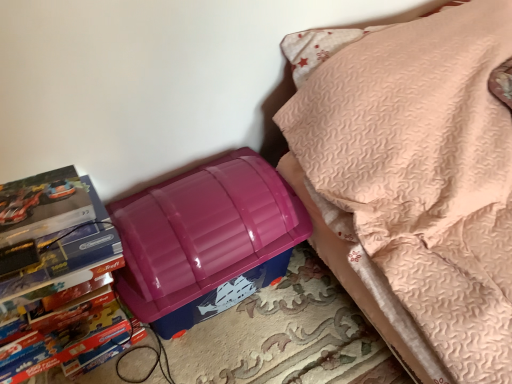
The image size is (512, 384). What do you see at coordinates (65, 289) in the screenshot?
I see `matte cardboard book at left` at bounding box center [65, 289].

At what (x,y) coordinates should I click in order to perform the action: click on purple plastic storage bin at lower left. Please return your answer as a coordinate pair (x, y). The height and width of the screenshot is (384, 512). Looking at the image, I should click on (412, 181).

Describe the element at coordinates (412, 181) in the screenshot. I see `purple plastic storage bin at lower left` at that location.

Where is `matte cardboard book at left`? Image resolution: width=512 pixels, height=384 pixels. matte cardboard book at left is located at coordinates [65, 289].

Is purple plastic storage bin at lower left positioned in front of matte cardboard book at left?

Yes, it is in front of matte cardboard book at left.

Would you say purple plastic storage bin at lower left is inside or outside matte cardboard book at left?

purple plastic storage bin at lower left is spatially situated outside matte cardboard book at left.

From a real-world perspective, which is physically above, purple plastic storage bin at lower left or matte cardboard book at left?

purple plastic storage bin at lower left.

In terms of size, does purple plastic storage bin at lower left appear bigger or smaller than matte cardboard book at left?

Considering their sizes, purple plastic storage bin at lower left takes up more space than matte cardboard book at left.

Is matte cardboard book at left taller or shorter than purple plastic storage bin at lower left?

Considering their sizes, matte cardboard book at left has less height than purple plastic storage bin at lower left.

Would you consider matte cardboard book at left to be distant from purple plastic storage bin at lower left?

No, matte cardboard book at left is not far away from purple plastic storage bin at lower left.

Is matte cardboard book at left bigger than purple plastic storage bin at lower left?

Incorrect, matte cardboard book at left is not larger than purple plastic storage bin at lower left.

Consider the image. Would you say matte cardboard book at left is inside or outside purple plastic storage bin at lower left?

The correct answer is: outside.

In the scene shown: Is purple plastic storage bin at lower left further to camera compared to glossy plastic lunch box at lower left?

That is False.

Is purple plastic storage bin at lower left turned away from glossy plastic lunch box at lower left?

No.

Considering the sizes of objects purple plastic storage bin at lower left and glossy plastic lunch box at lower left in the image provided, who is shorter, purple plastic storage bin at lower left or glossy plastic lunch box at lower left?

glossy plastic lunch box at lower left.

Image resolution: width=512 pixels, height=384 pixels. In order to click on lunch box on the left of purple plastic storage bin at lower left in this screenshot , I will do `click(206, 240)`.

Would you say glossy plastic lunch box at lower left is a long distance from purple plastic storage bin at lower left?

glossy plastic lunch box at lower left is near purple plastic storage bin at lower left, not far away.

Can you tell me how much glossy plastic lunch box at lower left and purple plastic storage bin at lower left differ in facing direction?

89.4 degrees separate the facing orientations of glossy plastic lunch box at lower left and purple plastic storage bin at lower left.

Who is smaller, glossy plastic lunch box at lower left or purple plastic storage bin at lower left?

glossy plastic lunch box at lower left is smaller.

Locate an element on the screen. The width and height of the screenshot is (512, 384). lunch box behind the matte cardboard book at left is located at coordinates (206, 240).

Is glossy plastic lunch box at lower left in contact with matte cardboard book at left?

No, glossy plastic lunch box at lower left is not beside matte cardboard book at left.

Is glossy plastic lunch box at lower left wider than matte cardboard book at left?

Indeed, glossy plastic lunch box at lower left has a greater width compared to matte cardboard book at left.

Can you tell me how much glossy plastic lunch box at lower left and matte cardboard book at left differ in facing direction?

0.000575 degrees.

Is point (56, 264) positioned before point (137, 270)?

Yes.

From a real-world perspective, between matte cardboard book at left and glossy plastic lunch box at lower left, who is vertically lower?

In real-world perspective, glossy plastic lunch box at lower left is lower.

Could you tell me if matte cardboard book at left is turned towards glossy plastic lunch box at lower left?

No.

Relative to glossy plastic lunch box at lower left, is matte cardboard book at left in front or behind?

Clearly, matte cardboard book at left is in front of glossy plastic lunch box at lower left.

Identify the location of furniture located above the matte cardboard book at left (from the image's perspective). Image resolution: width=512 pixels, height=384 pixels. (412, 181).

You are a GUI agent. You are given a task and a screenshot of the screen. Output one action in this format:
    pyautogui.click(x=<x>, y=<y>)
    Task: Click on the furniture that appears on the right of matte cardboard book at left
    The width and height of the screenshot is (512, 384).
    Given the screenshot: What is the action you would take?
    pyautogui.click(x=412, y=181)

Looking at the image, which one is located further to glossy plastic lunch box at lower left, purple plastic storage bin at lower left or matte cardboard book at left?

Based on the image, purple plastic storage bin at lower left appears to be further to glossy plastic lunch box at lower left.

When comparing their distances from purple plastic storage bin at lower left, does matte cardboard book at left or glossy plastic lunch box at lower left seem closer?

glossy plastic lunch box at lower left is positioned closer to the anchor purple plastic storage bin at lower left.

Looking at the image, which one is located further to glossy plastic lunch box at lower left, matte cardboard book at left or purple plastic storage bin at lower left?

Based on the image, purple plastic storage bin at lower left appears to be further to glossy plastic lunch box at lower left.

From the image, which object appears to be nearer to matte cardboard book at left, purple plastic storage bin at lower left or glossy plastic lunch box at lower left?

Based on the image, glossy plastic lunch box at lower left appears to be nearer to matte cardboard book at left.

Which object lies nearer to the anchor point purple plastic storage bin at lower left, glossy plastic lunch box at lower left or matte cardboard book at left?

The object closer to purple plastic storage bin at lower left is glossy plastic lunch box at lower left.

Based on the photo, when comparing their distances from matte cardboard book at left, does glossy plastic lunch box at lower left or purple plastic storage bin at lower left seem further?

Based on the image, purple plastic storage bin at lower left appears to be further to matte cardboard book at left.

Locate an element on the screen. Image resolution: width=512 pixels, height=384 pixels. lunch box located between matte cardboard book at left and purple plastic storage bin at lower left in the left-right direction is located at coordinates (206, 240).